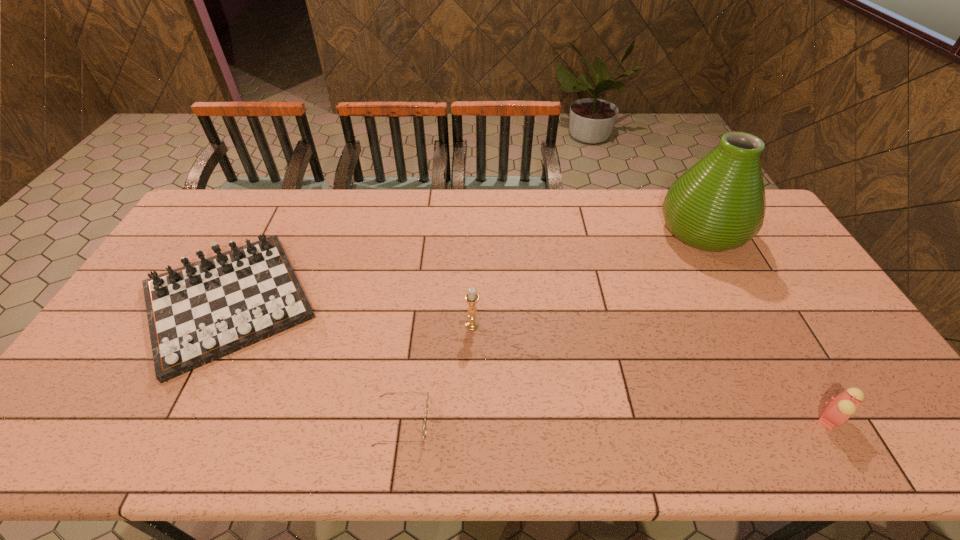
You are a GUI agent. You are given a task and a screenshot of the screen. Output one action in this format:
    pyautogui.click(x=<x>, y=<y>)
    Task: Click on the vacant region located on the front-facing side of the shortest object
    The height and width of the screenshot is (540, 960).
    Given the screenshot: What is the action you would take?
    pyautogui.click(x=492, y=423)

Image resolution: width=960 pixels, height=540 pixels. What are the coordinates of `object at the far edge` in the screenshot? It's located at (718, 204).

Locate an element on the screen. alarm clock that is positioned at the near edge is located at coordinates (841, 408).

At what (x,y) coordinates should I click in order to perform the action: click on sunglasses that is at the near edge. Please return your answer as a coordinate pair (x, y). Looking at the image, I should click on (426, 411).

The height and width of the screenshot is (540, 960). Find the location of `object that is at the left edge`. object that is at the left edge is located at coordinates (201, 312).

Locate an element on the screen. This screenshot has height=540, width=960. vase present at the right edge is located at coordinates 718,204.

I want to click on alarm clock present at the right edge, so click(x=841, y=408).

This screenshot has width=960, height=540. I want to click on object that is at the far right corner, so click(718, 204).

Locate an element on the screen. This screenshot has width=960, height=540. object that is at the near right corner is located at coordinates (841, 408).

Find the location of a particular element. This screenshot has width=960, height=540. vacant space at the far edge is located at coordinates (573, 210).